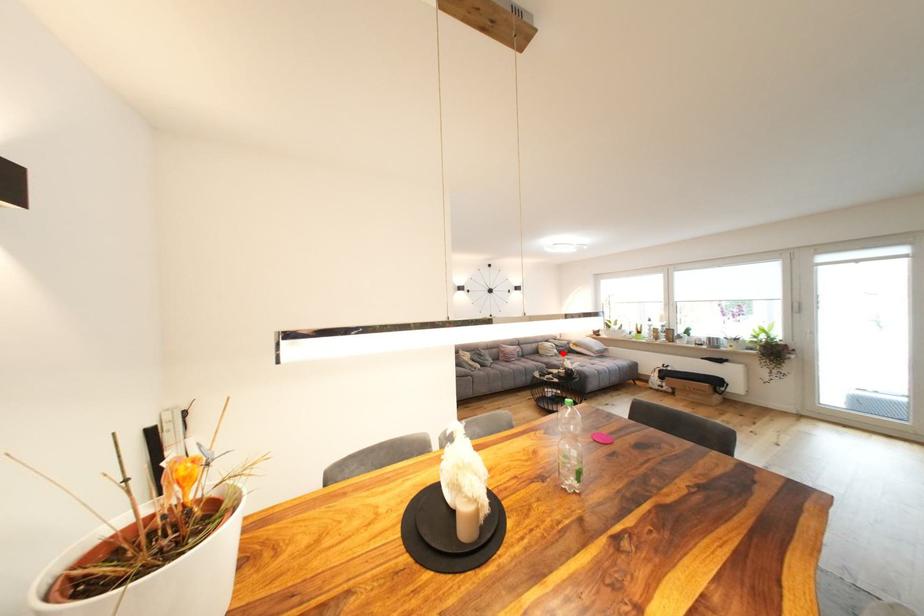
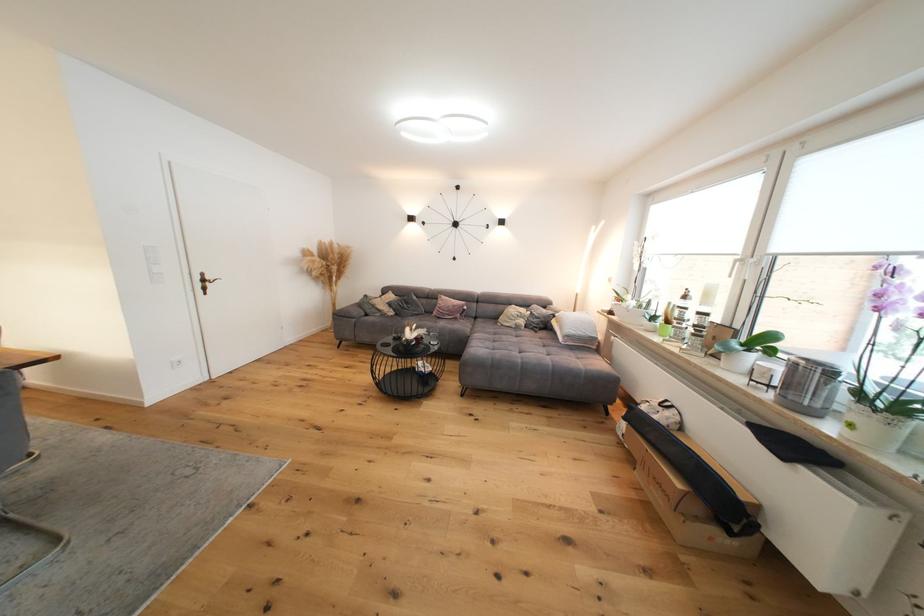
Question: I am providing you with two images of the same scene from different viewpoints. In image1, a red point is highlighted. Considering the same 3D point in image2, which of the following is correct?

Choices:
 (A) It is closer
 (B) It is farther

Answer: (A)